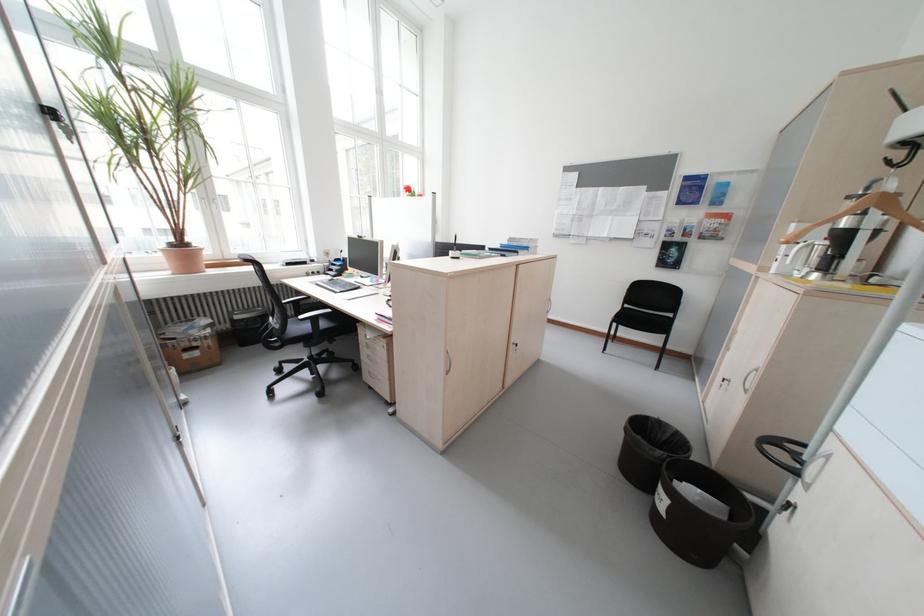
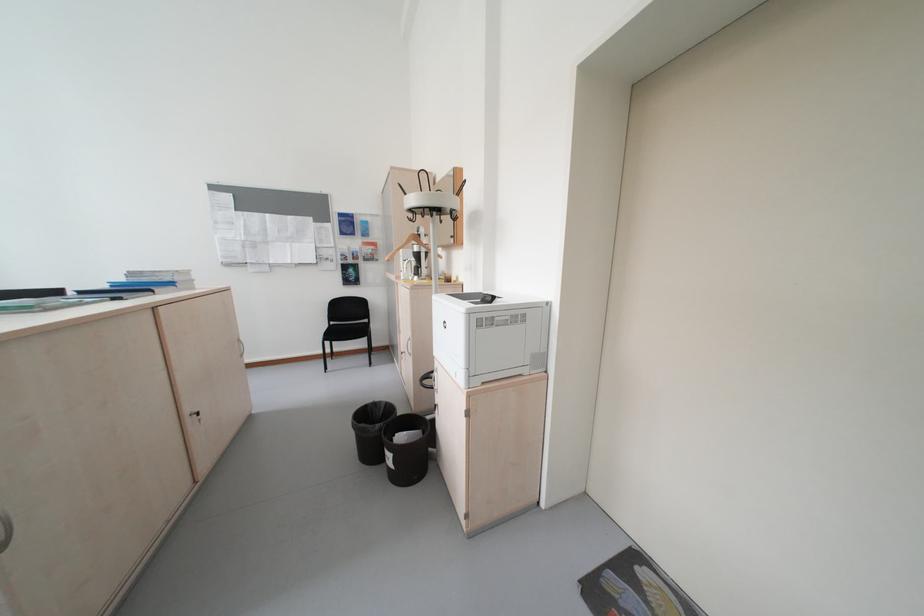
Where in the second image is the point corresponding to point (767, 371) from the first image?

(419, 341)